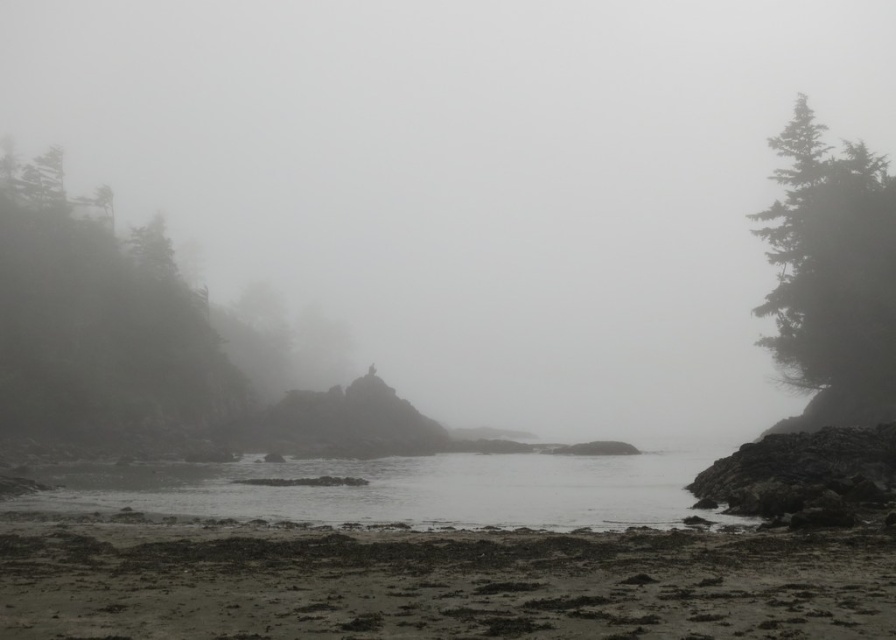
Question: Is foggy mist at center smaller than dark sand at lower center?

Choices:
 (A) no
 (B) yes

Answer: (A)

Question: Can you confirm if foggy mist at center is smaller than gray matte water at center?

Choices:
 (A) yes
 (B) no

Answer: (B)

Question: Is foggy mist at center wider than green matte tree at right?

Choices:
 (A) yes
 (B) no

Answer: (A)

Question: Which point is closer to the camera?

Choices:
 (A) (106, 570)
 (B) (102, 324)
 (C) (800, 340)

Answer: (A)

Question: Among these objects, which one is nearest to the camera?

Choices:
 (A) green matte tree at right
 (B) foggy mist at center

Answer: (A)

Question: Based on their relative distances, which object is nearer to the dark sand at lower center?

Choices:
 (A) green matte tree at left
 (B) foggy mist at center

Answer: (A)